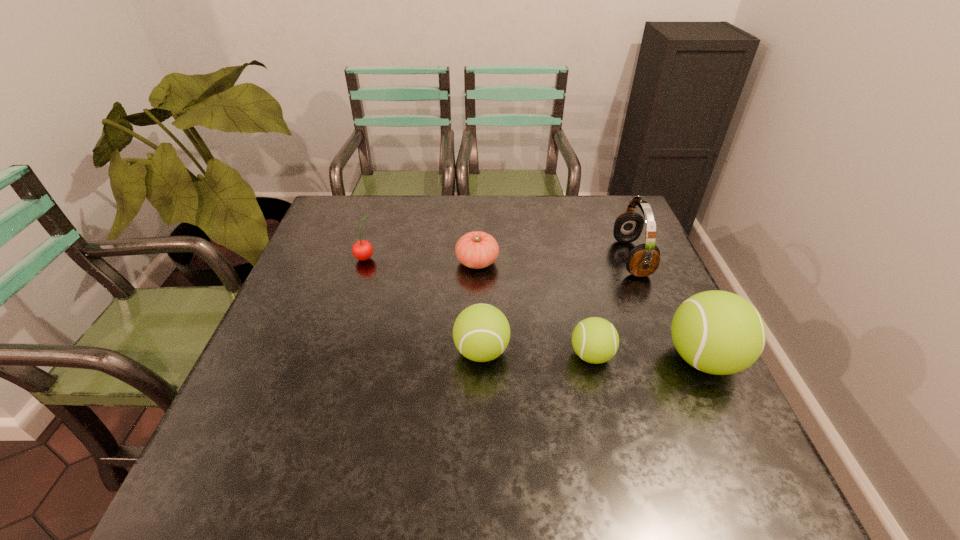
The image size is (960, 540). Find the location of `vacant region that satisfies the following two spatial constraints: 1. on the ear cups of the headset; 2. on the left side of the tallest tennis ball`. vacant region that satisfies the following two spatial constraints: 1. on the ear cups of the headset; 2. on the left side of the tallest tennis ball is located at coordinates (673, 359).